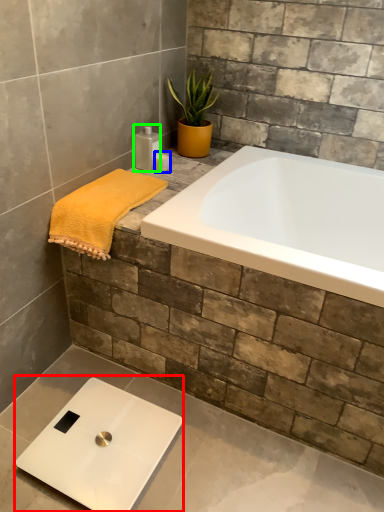
Question: Considering the real-world distances, which object is farthest from scale (highlighted by a red box)? toiletry (highlighted by a blue box) or toiletry (highlighted by a green box)?

Choices:
 (A) toiletry
 (B) toiletry

Answer: (A)